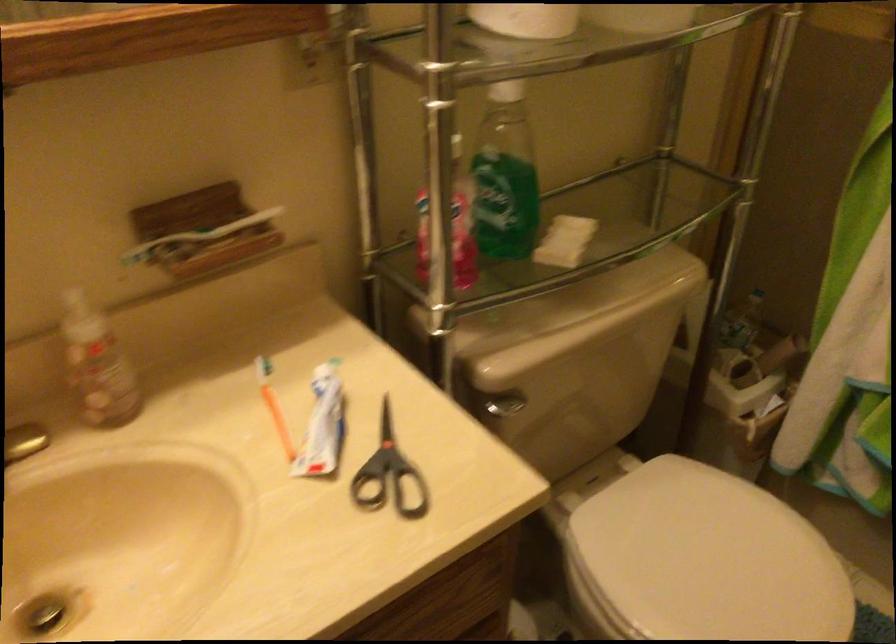
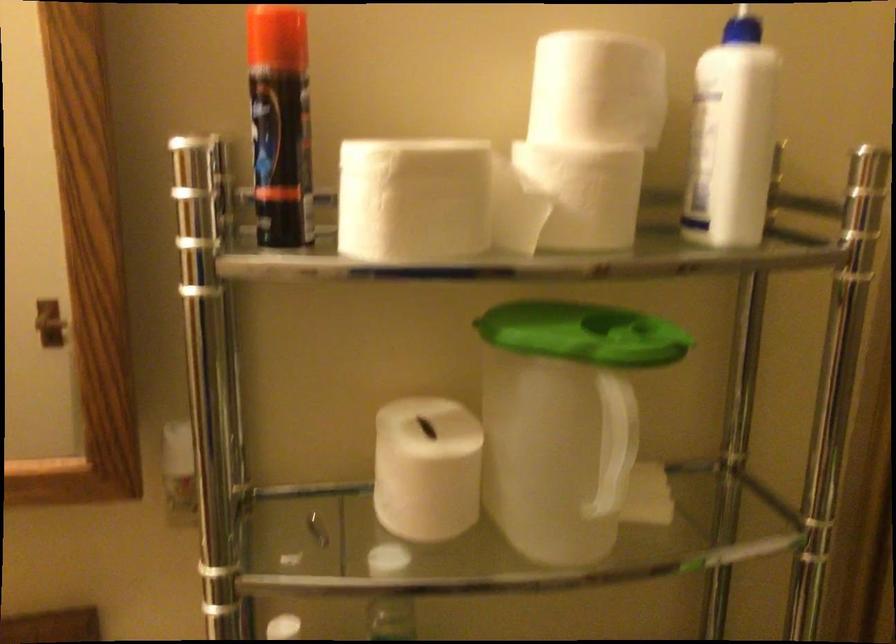
First-person continuous shooting, in which direction is the camera rotating?

The camera's rotation is toward left-up.